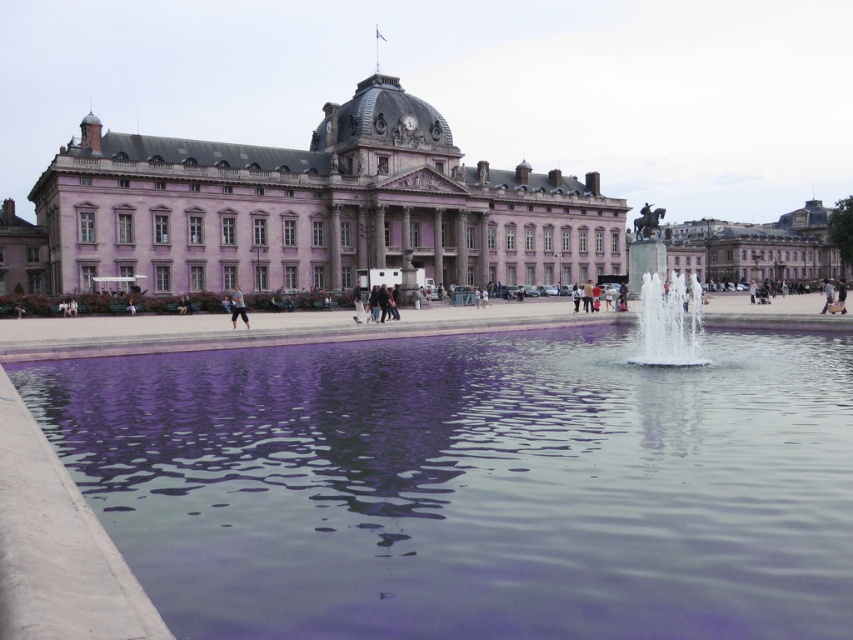
You are standing in front of the grand neoclassical building with the dome and columns. You see a light brown leather jacket at center. Where exactly is the light brown leather jacket located in relation to the building?

The light brown leather jacket at center is located at point (236, 307) in relation to the building.

You are standing in front of the pink stone palace at center and the clear glass fountain at center. Which object is closer to your right side?

The clear glass fountain at center is closer to your right side because the pink stone palace at center is to the left of it.

You are standing in front of the grand building and notice two items on the ground. Which item is positioned to the left when looking at the light brown leather jacket at center and the dark gray fabric pants at center?

The light brown leather jacket at center is positioned to the left of the dark gray fabric pants at center.